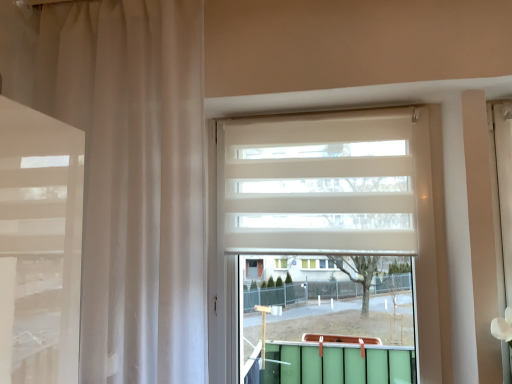
Question: Does point (297, 195) appear closer or farther from the camera than point (45, 46)?

Choices:
 (A) farther
 (B) closer

Answer: (A)

Question: Is white matte window at center taller or shorter than sheer white curtain at left?

Choices:
 (A) tall
 (B) short

Answer: (B)

Question: Based on their relative distances, which object is farther from the white matte blind at center?

Choices:
 (A) sheer white curtain at left
 (B) white matte window at center

Answer: (A)

Question: Which of these objects is positioned farthest from the white matte window at center?

Choices:
 (A) sheer white curtain at left
 (B) white matte blind at center

Answer: (A)